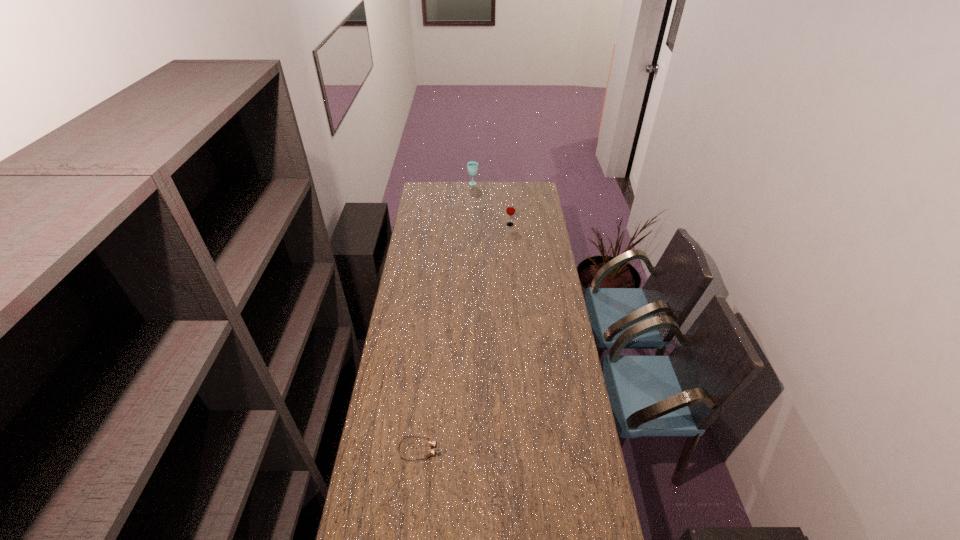
This screenshot has width=960, height=540. Find the location of `the farthest object`. the farthest object is located at coordinates (472, 166).

I want to click on the farther glass, so click(472, 166).

Find the location of a particular element. the right glass is located at coordinates (510, 210).

I want to click on the rightmost object, so click(x=510, y=210).

At what (x,y) coordinates should I click in order to perform the action: click on goggles. Please return your answer as a coordinate pair (x, y). Image resolution: width=960 pixels, height=540 pixels. Looking at the image, I should click on (432, 443).

Where is `the leftmost object`? the leftmost object is located at coordinates (432, 443).

Locate an element on the screen. This screenshot has width=960, height=540. vacant space situated 0.280m on the left of the farther glass is located at coordinates (x=427, y=184).

What are the coordinates of `vacant area situated 0.310m on the left of the right glass` in the screenshot? It's located at (454, 225).

Locate an element on the screen. The height and width of the screenshot is (540, 960). free space located on the front lenses and sides of the leftmost object is located at coordinates (492, 450).

Identify the location of object situated at the far edge. (472, 166).